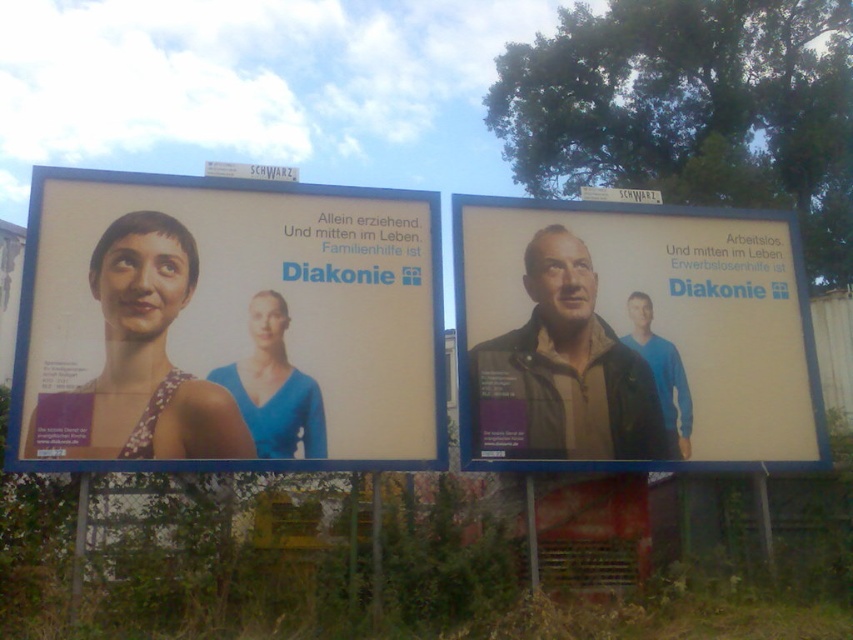
Question: Which point is farther from the camera taking this photo?

Choices:
 (A) (339, 422)
 (B) (659, 403)

Answer: (B)

Question: In this image, where is matte plastic billboard at center located relative to matte brown jacket at center?

Choices:
 (A) above
 (B) below

Answer: (A)

Question: From the image, what is the correct spatial relationship of matte plastic billboard at center in relation to matte brown jacket at center?

Choices:
 (A) below
 (B) above

Answer: (B)

Question: Which point is farther from the camera taking this photo?

Choices:
 (A) (579, 260)
 (B) (193, 332)

Answer: (A)

Question: Is matte plastic billboard at center below matte brown jacket at center?

Choices:
 (A) no
 (B) yes

Answer: (A)

Question: Which object appears farthest from the camera in this image?

Choices:
 (A) matte brown jacket at center
 (B) matte plastic billboard at center

Answer: (A)